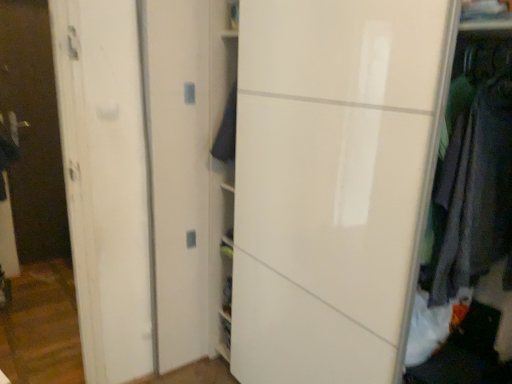
Question: From the image's perspective, is dark blue fabric at center, the second clothing when ordered from front to back, above or below transparent glass door at left?

Choices:
 (A) below
 (B) above

Answer: (A)

Question: Visually, is dark blue fabric at center, the second clothing when ordered from front to back, positioned to the left or to the right of transparent glass door at left?

Choices:
 (A) left
 (B) right

Answer: (B)

Question: Which object is positioned farthest from the dark gray fabric at right, which appears as the 1th clothing when viewed from the front?

Choices:
 (A) dark blue fabric at center, the second clothing when ordered from front to back
 (B) transparent glass door at left

Answer: (B)

Question: Which object is positioned closest to the dark blue fabric at center, which is the 1th clothing from back to front?

Choices:
 (A) transparent glass door at left
 (B) dark gray fabric at right, marked as the 1th clothing in a right-to-left arrangement

Answer: (B)